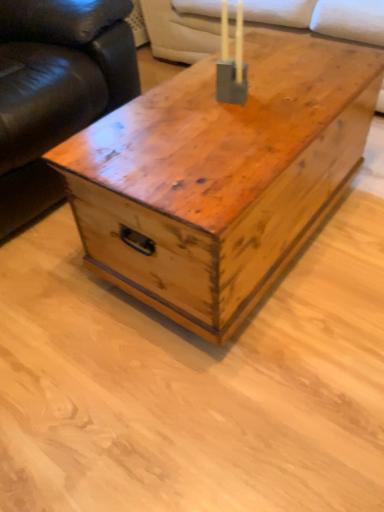
Question: Can you confirm if matte gray concrete candle holder at center is wider than wooden trunk at center?

Choices:
 (A) no
 (B) yes

Answer: (A)

Question: Is matte gray concrete candle holder at center closer to camera compared to wooden trunk at center?

Choices:
 (A) yes
 (B) no

Answer: (B)

Question: Is matte gray concrete candle holder at center smaller than wooden trunk at center?

Choices:
 (A) yes
 (B) no

Answer: (A)

Question: From the image's perspective, would you say matte gray concrete candle holder at center is shown under wooden trunk at center?

Choices:
 (A) yes
 (B) no

Answer: (B)

Question: Is wooden trunk at center at the back of matte gray concrete candle holder at center?

Choices:
 (A) yes
 (B) no

Answer: (B)

Question: From a real-world perspective, is leather couch at left above or below wooden trunk at center?

Choices:
 (A) below
 (B) above

Answer: (B)

Question: Is leather couch at left taller or shorter than wooden trunk at center?

Choices:
 (A) short
 (B) tall

Answer: (B)

Question: Is leather couch at left bigger or smaller than wooden trunk at center?

Choices:
 (A) big
 (B) small

Answer: (A)

Question: From the image's perspective, is leather couch at left above or below wooden trunk at center?

Choices:
 (A) below
 (B) above

Answer: (B)

Question: Looking at the image, does suede-like beige couch at upper center seem bigger or smaller compared to matte gray concrete candle holder at center?

Choices:
 (A) small
 (B) big

Answer: (B)

Question: From a real-world perspective, is suede-like beige couch at upper center above or below matte gray concrete candle holder at center?

Choices:
 (A) above
 (B) below

Answer: (B)

Question: Is suede-like beige couch at upper center in front of or behind matte gray concrete candle holder at center in the image?

Choices:
 (A) front
 (B) behind

Answer: (B)

Question: Is suede-like beige couch at upper center inside the boundaries of matte gray concrete candle holder at center, or outside?

Choices:
 (A) inside
 (B) outside

Answer: (B)

Question: From the image's perspective, relative to wooden trunk at center, is suede-like beige couch at upper center above or below?

Choices:
 (A) above
 (B) below

Answer: (A)

Question: From a real-world perspective, relative to wooden trunk at center, is suede-like beige couch at upper center vertically above or below?

Choices:
 (A) above
 (B) below

Answer: (B)